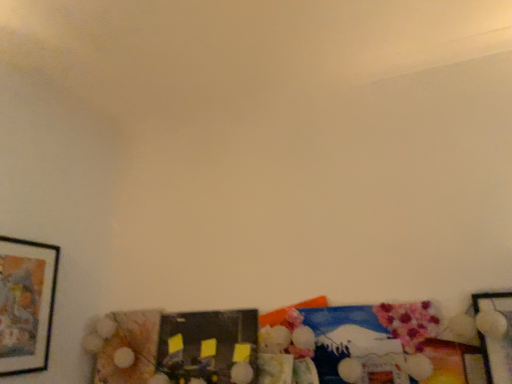
Question: Does matte black picture frame at left, acting as the 3th picture frame starting from the right, have a lesser width compared to matte black picture frame at center, placed as the second picture frame when sorted from left to right?

Choices:
 (A) no
 (B) yes

Answer: (B)

Question: Is matte black picture frame at left, acting as the 3th picture frame starting from the right, to the right of matte black picture frame at center, placed as the second picture frame when sorted from left to right, from the viewer's perspective?

Choices:
 (A) yes
 (B) no

Answer: (B)

Question: From a real-world perspective, is matte black picture frame at left, the 1th picture frame from the left, under matte black picture frame at center, the second picture frame from the right?

Choices:
 (A) yes
 (B) no

Answer: (B)

Question: Is matte black picture frame at left, acting as the 3th picture frame starting from the right, aimed at matte black picture frame at center, the second picture frame from the right?

Choices:
 (A) no
 (B) yes

Answer: (A)

Question: From a real-world perspective, is matte black picture frame at left, acting as the 3th picture frame starting from the right, on matte black picture frame at center, placed as the second picture frame when sorted from left to right?

Choices:
 (A) yes
 (B) no

Answer: (A)

Question: In the image, is metallic silver picture frame at lower right, marked as the first picture frame in a right-to-left arrangement, on the left side or the right side of matte black picture frame at center, the second picture frame from the right?

Choices:
 (A) left
 (B) right

Answer: (B)

Question: From the image's perspective, is metallic silver picture frame at lower right, marked as the first picture frame in a right-to-left arrangement, positioned above or below matte black picture frame at center, the second picture frame from the right?

Choices:
 (A) above
 (B) below

Answer: (A)

Question: Is metallic silver picture frame at lower right, marked as the first picture frame in a right-to-left arrangement, wider or thinner than matte black picture frame at center, placed as the second picture frame when sorted from left to right?

Choices:
 (A) wide
 (B) thin

Answer: (A)

Question: From a real-world perspective, relative to matte black picture frame at center, the second picture frame from the right, is metallic silver picture frame at lower right, the 3th picture frame positioned from the left, vertically above or below?

Choices:
 (A) above
 (B) below

Answer: (A)

Question: Is matte black picture frame at left, the 1th picture frame from the left, situated inside matte black picture frame at center, placed as the second picture frame when sorted from left to right, or outside?

Choices:
 (A) outside
 (B) inside

Answer: (A)

Question: Considering their positions, is matte black picture frame at left, the 1th picture frame from the left, located in front of or behind matte black picture frame at center, the second picture frame from the right?

Choices:
 (A) front
 (B) behind

Answer: (A)

Question: Considering the relative positions of matte black picture frame at left, the 1th picture frame from the left, and matte black picture frame at center, placed as the second picture frame when sorted from left to right, in the image provided, is matte black picture frame at left, the 1th picture frame from the left, to the left or to the right of matte black picture frame at center, placed as the second picture frame when sorted from left to right,?

Choices:
 (A) right
 (B) left

Answer: (B)

Question: Is point (25, 286) positioned closer to the camera than point (172, 342)?

Choices:
 (A) farther
 (B) closer

Answer: (B)

Question: Is matte black picture frame at left, the 1th picture frame from the left, bigger or smaller than metallic silver picture frame at lower right, the 3th picture frame positioned from the left?

Choices:
 (A) big
 (B) small

Answer: (A)

Question: From a real-world perspective, is matte black picture frame at left, acting as the 3th picture frame starting from the right, positioned above or below metallic silver picture frame at lower right, the 3th picture frame positioned from the left?

Choices:
 (A) below
 (B) above

Answer: (B)